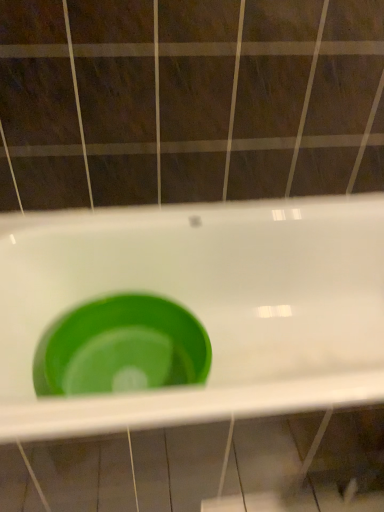
Question: Is green plastic sink at center positioned beyond the bounds of green plastic basin at center?

Choices:
 (A) yes
 (B) no

Answer: (A)

Question: Is green plastic sink at center bigger than green plastic basin at center?

Choices:
 (A) no
 (B) yes

Answer: (B)

Question: From the image's perspective, is green plastic sink at center below green plastic basin at center?

Choices:
 (A) yes
 (B) no

Answer: (A)

Question: Can you confirm if green plastic sink at center is positioned to the left of green plastic basin at center?

Choices:
 (A) no
 (B) yes

Answer: (A)

Question: Is green plastic sink at center thinner than green plastic basin at center?

Choices:
 (A) no
 (B) yes

Answer: (A)

Question: Is the surface of green plastic sink at center in direct contact with green plastic basin at center?

Choices:
 (A) yes
 (B) no

Answer: (B)

Question: From the image's perspective, is green plastic basin at center on top of green plastic sink at center?

Choices:
 (A) yes
 (B) no

Answer: (A)

Question: From a real-world perspective, is green plastic basin at center under green plastic sink at center?

Choices:
 (A) yes
 (B) no

Answer: (A)

Question: Does green plastic basin at center lie behind green plastic sink at center?

Choices:
 (A) no
 (B) yes

Answer: (B)

Question: Does green plastic basin at center have a lesser height compared to green plastic sink at center?

Choices:
 (A) yes
 (B) no

Answer: (A)

Question: Does green plastic basin at center turn towards green plastic sink at center?

Choices:
 (A) no
 (B) yes

Answer: (B)

Question: Is green plastic basin at center bigger than green plastic sink at center?

Choices:
 (A) yes
 (B) no

Answer: (B)

Question: Is green plastic basin at center bigger or smaller than green plastic sink at center?

Choices:
 (A) big
 (B) small

Answer: (B)